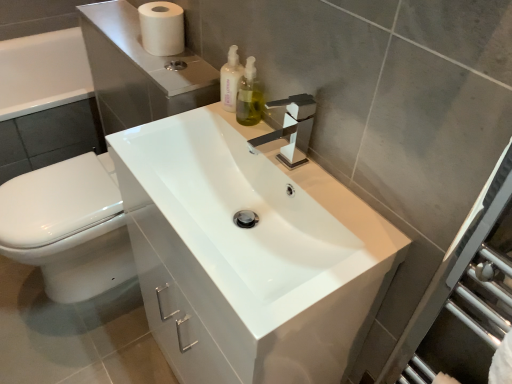
Question: From the image's perspective, would you say white glossy toilet at lower left is shown under green glass soap dispenser at upper center, the first soap dispenser from the right?

Choices:
 (A) yes
 (B) no

Answer: (A)

Question: Is white glossy toilet at lower left thinner than green glass soap dispenser at upper center, the first soap dispenser from the right?

Choices:
 (A) no
 (B) yes

Answer: (A)

Question: From a real-world perspective, is white glossy toilet at lower left positioned over green glass soap dispenser at upper center, the first soap dispenser from the right, based on gravity?

Choices:
 (A) yes
 (B) no

Answer: (B)

Question: Is white glossy toilet at lower left smaller than green glass soap dispenser at upper center, arranged as the 2th soap dispenser when viewed from the left?

Choices:
 (A) yes
 (B) no

Answer: (B)

Question: Considering the relative sizes of white glossy toilet at lower left and green glass soap dispenser at upper center, the first soap dispenser from the right, in the image provided, is white glossy toilet at lower left bigger than green glass soap dispenser at upper center, the first soap dispenser from the right,?

Choices:
 (A) yes
 (B) no

Answer: (A)

Question: Visually, is white glossy toilet at lower left positioned to the left or to the right of white matte toilet paper at upper left?

Choices:
 (A) left
 (B) right

Answer: (A)

Question: From a real-world perspective, is white glossy toilet at lower left above or below white matte toilet paper at upper left?

Choices:
 (A) below
 (B) above

Answer: (A)

Question: From the image's perspective, relative to white matte toilet paper at upper left, is white glossy toilet at lower left above or below?

Choices:
 (A) below
 (B) above

Answer: (A)

Question: Is white glossy toilet at lower left in front of or behind white matte toilet paper at upper left in the image?

Choices:
 (A) front
 (B) behind

Answer: (B)

Question: Do you think white matte toilet paper at upper left is within translucent plastic soap dispenser at upper center, which appears as the 2th soap dispenser when viewed from the right, or outside of it?

Choices:
 (A) inside
 (B) outside

Answer: (B)

Question: Considering their positions, is white matte toilet paper at upper left located in front of or behind translucent plastic soap dispenser at upper center, which appears as the 2th soap dispenser when viewed from the right?

Choices:
 (A) behind
 (B) front

Answer: (A)

Question: From the image's perspective, relative to translucent plastic soap dispenser at upper center, which appears as the 2th soap dispenser when viewed from the right, is white matte toilet paper at upper left above or below?

Choices:
 (A) below
 (B) above

Answer: (B)

Question: Would you say white matte toilet paper at upper left is to the left or to the right of translucent plastic soap dispenser at upper center, the 1th soap dispenser in the left-to-right sequence, in the picture?

Choices:
 (A) left
 (B) right

Answer: (A)

Question: Considering the relative positions of white glossy sink at center and white matte toilet paper at upper left in the image provided, is white glossy sink at center to the left or to the right of white matte toilet paper at upper left?

Choices:
 (A) left
 (B) right

Answer: (B)

Question: Considering the positions of white glossy sink at center and white matte toilet paper at upper left in the image, is white glossy sink at center taller or shorter than white matte toilet paper at upper left?

Choices:
 (A) short
 (B) tall

Answer: (B)